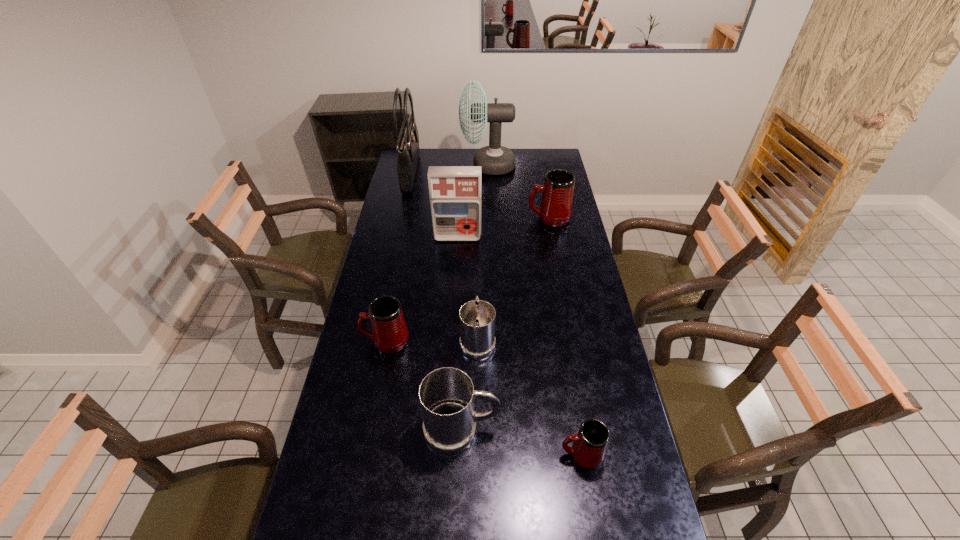
I want to click on vacant space located on the side of the bigger gray mug with the handle, so click(630, 430).

Where is `vacant space positioned on the side of the smaller gray mug with the handle`? vacant space positioned on the side of the smaller gray mug with the handle is located at coordinates (478, 282).

At what (x,y) coordinates should I click in order to perform the action: click on free space located 0.340m on the side of the smaller gray mug with the handle. Please return your answer as a coordinate pair (x, y). This screenshot has height=540, width=960. Looking at the image, I should click on (478, 259).

Where is `vacant region located 0.130m on the side of the smaller gray mug with the handle`? This screenshot has width=960, height=540. vacant region located 0.130m on the side of the smaller gray mug with the handle is located at coordinates (478, 295).

You are a GUI agent. You are given a task and a screenshot of the screen. Output one action in this format:
    pyautogui.click(x=<x>, y=<y>)
    Task: Click on the free point located on the side of the nearest red mug with the handle
    
    Given the screenshot: What is the action you would take?
    tap(504, 455)

Locate an element on the screen. The height and width of the screenshot is (540, 960). vacant space positioned 0.230m on the side of the nearest red mug with the handle is located at coordinates (479, 455).

At what (x,y) coordinates should I click in order to perform the action: click on free space located 0.390m on the side of the nearest red mug with the handle. Please return your answer as a coordinate pair (x, y). The width and height of the screenshot is (960, 540). Looking at the image, I should click on (423, 455).

Find the location of a particular element. fan that is at the far edge is located at coordinates (494, 159).

The width and height of the screenshot is (960, 540). What are the coordinates of `handbag present at the far edge` in the screenshot? It's located at (407, 146).

Find the location of a particular element. handbag at the left edge is located at coordinates (407, 146).